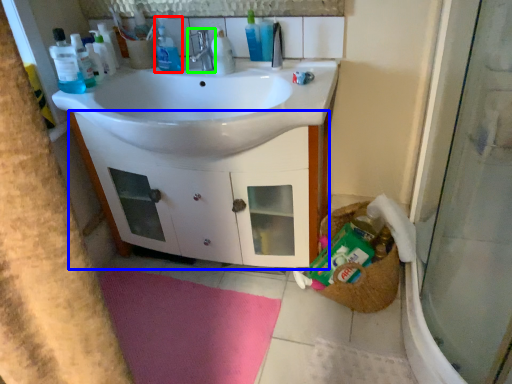
Question: Which object is positioned closest to cleaning product (highlighted by a red box)? Select from bathroom cabinet (highlighted by a blue box) and tap (highlighted by a green box).

Choices:
 (A) bathroom cabinet
 (B) tap

Answer: (B)